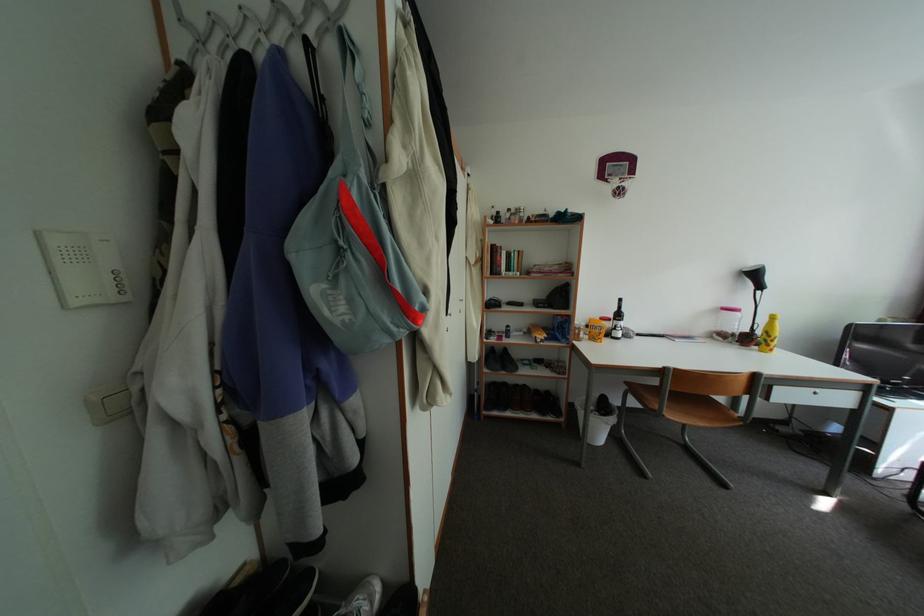
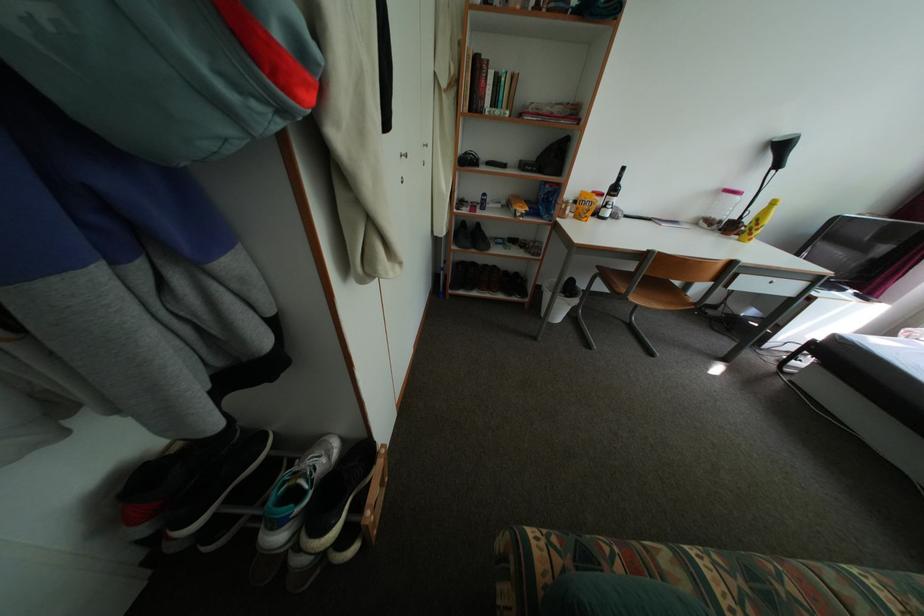
Question: The images are taken continuously from a first-person perspective. In which direction are you moving?

Choices:
 (A) Left
 (B) Right
 (C) Forward
 (D) Backward

Answer: (C)